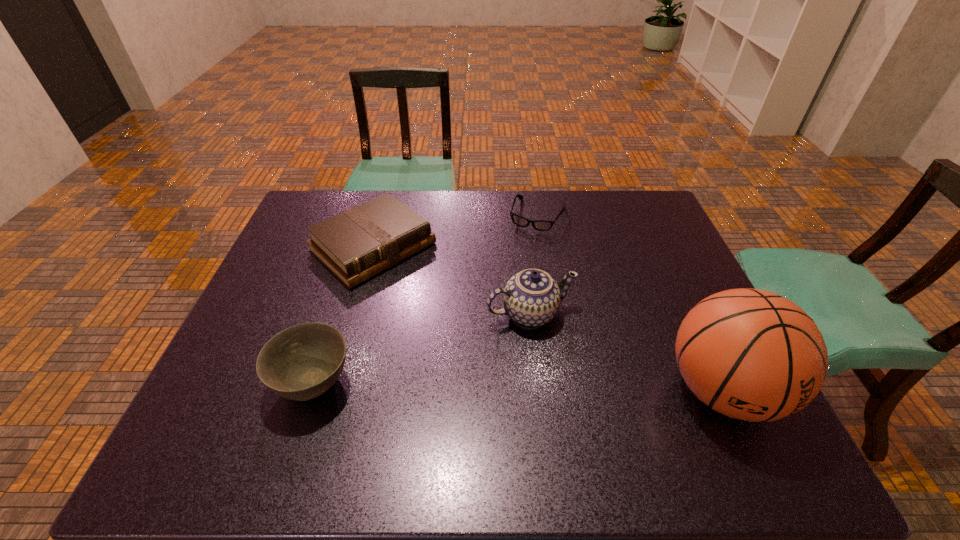
At what (x,y) coordinates should I click in order to perform the action: click on free area in between the shortest object and the basketball. Please return your answer as a coordinate pair (x, y). The width and height of the screenshot is (960, 540). Looking at the image, I should click on (630, 303).

I want to click on object that ranks as the second closest to the basketball, so click(541, 225).

Select which object appears as the third closest to the third shortest object. Please provide its 2D coordinates. Your answer should be formatted as a tuple, i.e. [(x, y)], where the tuple contains the x and y coordinates of a point satisfying the conditions above.

[(541, 225)]

What are the coordinates of `free space that satisfies the following two spatial constraints: 1. on the back side of the shortest object; 2. on the left side of the third shortest object` in the screenshot? It's located at (368, 215).